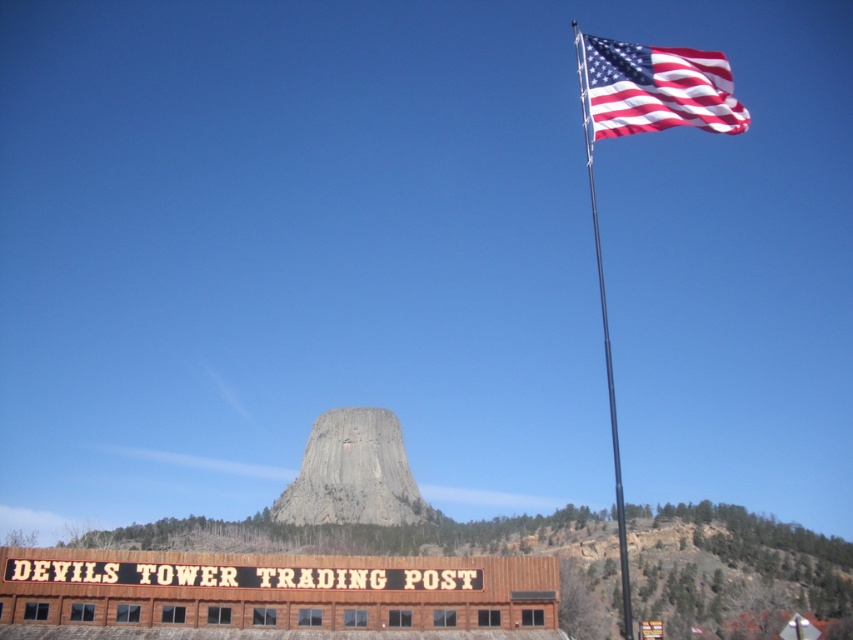
Is american flag at upper right positioned at the back of metallic flag pole at upper right?

No, american flag at upper right is closer to the viewer.

Does american flag at upper right appear on the right side of metallic flag pole at upper right?

Yes, american flag at upper right is to the right of metallic flag pole at upper right.

Does point (741, 131) lie behind point (611, 397)?

No, (741, 131) is in front of (611, 397).

Where is `american flag at upper right`? american flag at upper right is located at coordinates (656, 88).

Is gray rock formation at center in front of metallic flag pole at upper right?

No, it is not.

Which is more to the left, gray rock formation at center or metallic flag pole at upper right?

gray rock formation at center is more to the left.

At what (x,y) coordinates should I click in order to perform the action: click on gray rock formation at center. Please return your answer as a coordinate pair (x, y). The image size is (853, 640). Looking at the image, I should click on (352, 474).

This screenshot has height=640, width=853. I want to click on gray rock formation at center, so click(352, 474).

Can you confirm if gray rock formation at center is positioned to the right of american flag at upper right?

Incorrect, gray rock formation at center is not on the right side of american flag at upper right.

In the scene shown: Does gray rock formation at center have a greater height compared to american flag at upper right?

In fact, gray rock formation at center may be shorter than american flag at upper right.

What are the coordinates of `gray rock formation at center` in the screenshot? It's located at (352, 474).

This screenshot has width=853, height=640. Find the location of `gray rock formation at center`. gray rock formation at center is located at coordinates (352, 474).